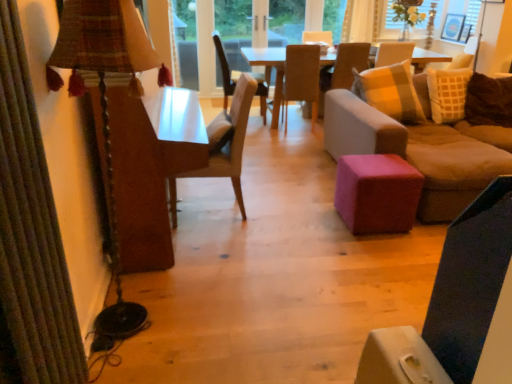
Identify the location of free space in front of pink fabric ottoman at center. (377, 246).